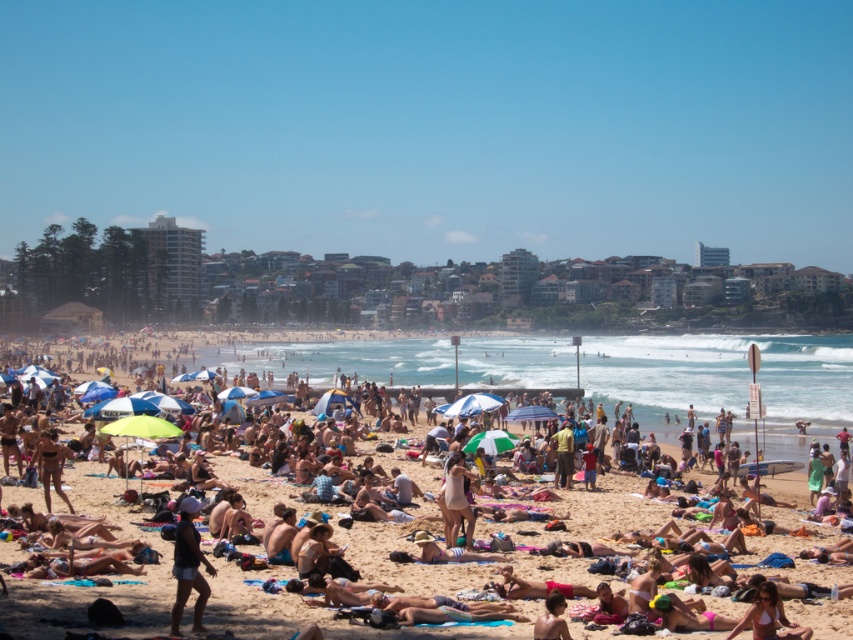
Question: Can you confirm if matte black shorts at lower center is bigger than smooth tan skin at lower center?

Choices:
 (A) no
 (B) yes

Answer: (B)

Question: Which of the following is the farthest from the observer?

Choices:
 (A) matte white bikini at center
 (B) tan skin person at center
 (C) matte black shorts at lower center
 (D) smooth tan skin at lower center

Answer: (A)

Question: Does tan skin person at center appear on the right side of matte black shorts at lower center?

Choices:
 (A) no
 (B) yes

Answer: (B)

Question: Which of the following is the farthest from the observer?

Choices:
 (A) (198, 608)
 (B) (549, 611)
 (C) (392, 433)
 (D) (456, 486)

Answer: (C)

Question: Which of the following is the closest to the observer?

Choices:
 (A) pos(102,496)
 (B) pos(194,621)

Answer: (B)

Question: Is tan skin person at center further to the viewer compared to smooth tan skin at lower center?

Choices:
 (A) no
 (B) yes

Answer: (B)